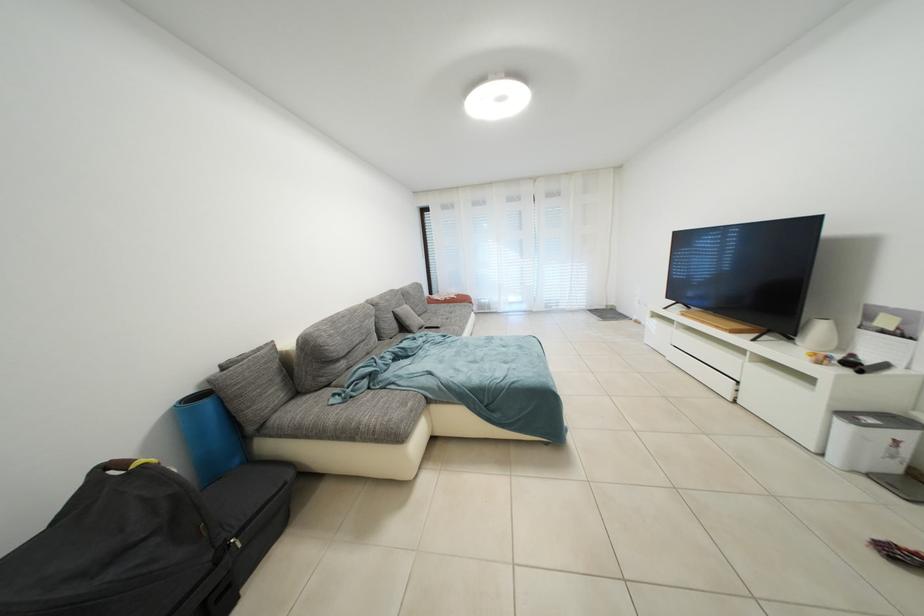
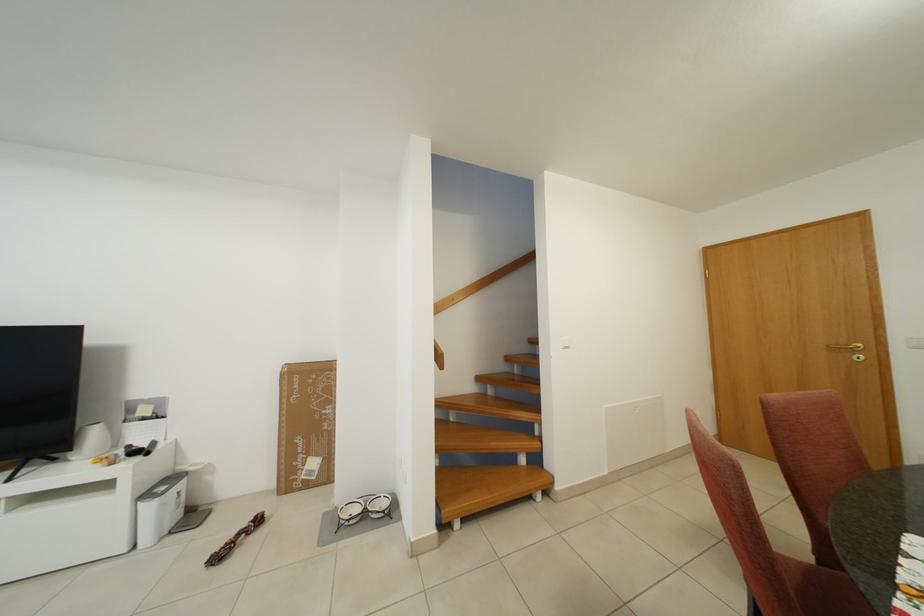
Where in the second image is the point corresponding to [880,426] from the first image?

(171, 493)